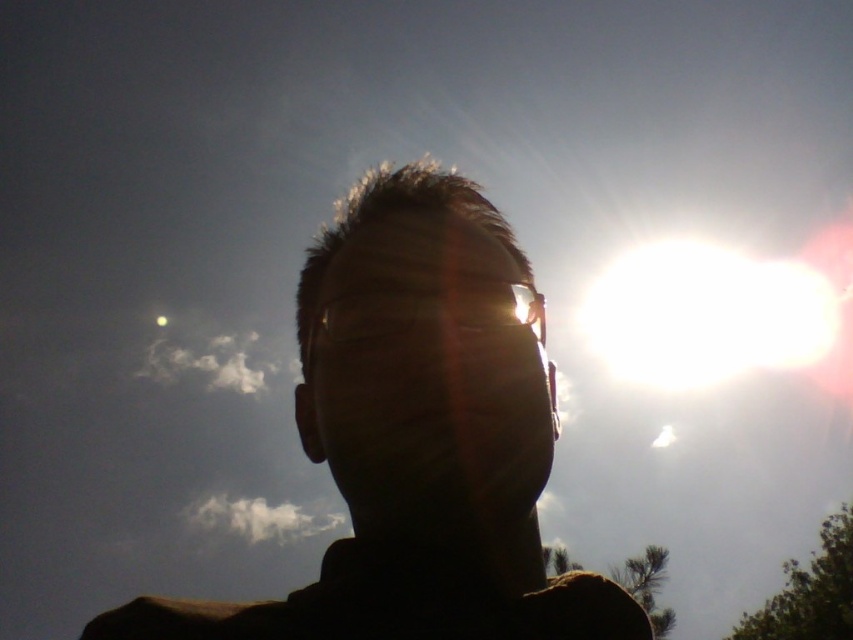
You are an artist trying to sketch this scene. You want to ensure the proportions are accurate. Which object should you draw first, the silhouette face at center or the white glossy sun at upper right, and why?

You should draw the white glossy sun at upper right first because the silhouette face at center is not as tall as the white glossy sun at upper right, so starting with the larger object ensures proper scaling for the smaller silhouette face at center.

You are a photographer trying to capture a portrait. You notice the silky skin face at center in your viewfinder. If you want to ensure the face is in focus, and your camera requires a minimum focus distance of 24 inches, will you need to adjust your position?

The silky skin face at center is 23.29 inches away from the camera, which is closer than the required minimum focus distance of 24 inches. Therefore, you need to move further away to ensure the face is in focus.

You are a photographer adjusting lighting to capture both the silhouette face at center and silky skin face at center clearly. Which face should you adjust the lighting for to ensure both are visible?

The silhouette face at center is much taller than the silky skin face at center, so adjusting the lighting for the silhouette face at center would help ensure both are visible.